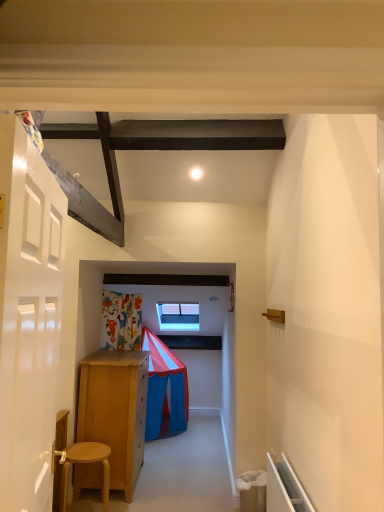
Where is `free space above light brown wooden stool at lower left (from a real-world perspective)`? free space above light brown wooden stool at lower left (from a real-world perspective) is located at coordinates (87, 449).